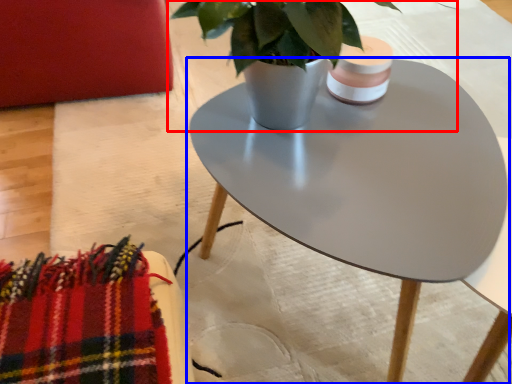
Question: Among these objects, which one is nearest to the camera, houseplant (highlighted by a red box) or coffee table (highlighted by a blue box)?

Choices:
 (A) houseplant
 (B) coffee table

Answer: (A)